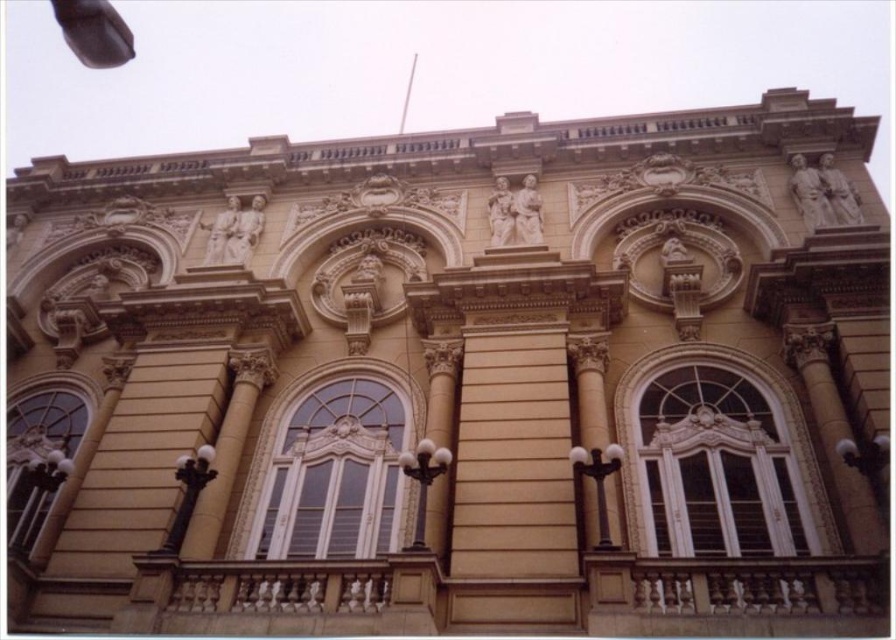
You are an architect evaluating the facade of this historical building. You need to determine which element occupies more space on the facade between the white glass window at center and the golden stone column at center. Based on the provided information, which one is larger?

The white glass window at center is bigger than the golden stone column at center, so the white glass window at center occupies more space on the facade.

Looking at this image, you are an architect inspecting the building facade. You notice the white glass window at center and the golden stone column at center. Which object is located higher up on the facade?

The golden stone column at center is located higher up on the facade than the white glass window at center.